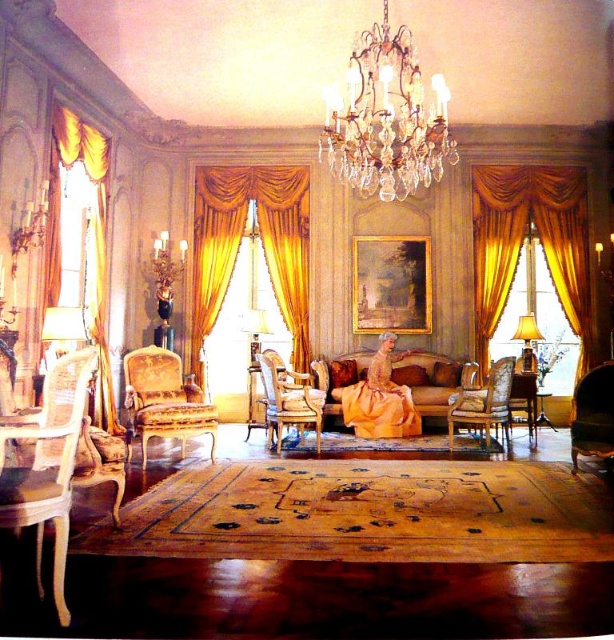
Question: Observing the image, what is the correct spatial positioning of gold velvet curtain at left in reference to matte gold lampshade at right?

Choices:
 (A) left
 (B) right

Answer: (A)

Question: Is gold velvet curtains at center bigger than velvet dark green armchair at lower right?

Choices:
 (A) yes
 (B) no

Answer: (A)

Question: Based on their relative distances, which object is nearer to the velvet dark green armchair at lower right?

Choices:
 (A) matte gold lampshade at right
 (B) gold velvet curtains at right

Answer: (A)

Question: Is gold velvet curtains at right below matte gold lampshade at center?

Choices:
 (A) yes
 (B) no

Answer: (B)

Question: Which object is farther from the camera taking this photo?

Choices:
 (A) crystal/glass chandelier at upper center
 (B) gold-patterned fabric armchair at center-left
 (C) gold velvet curtains at right

Answer: (C)

Question: Which object appears farthest from the camera in this image?

Choices:
 (A) gold-patterned fabric armchair at center-left
 (B) light brown wood armchair at left
 (C) velvet beige couch at center
 (D) velvet upholstered armchair at center

Answer: (C)